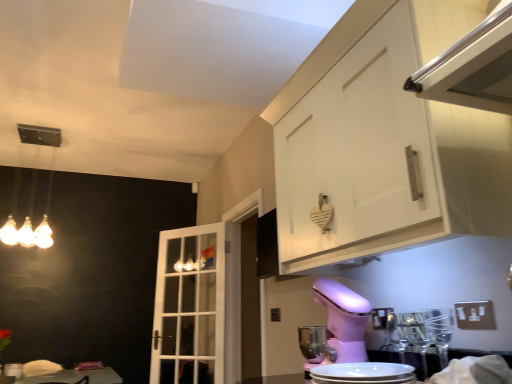
Question: Based on their sizes in the image, would you say pink plastic mixer at lower center is bigger or smaller than pink plastic stand mixer at lower center?

Choices:
 (A) small
 (B) big

Answer: (B)

Question: From a real-world perspective, is pink plastic mixer at lower center physically located above or below pink plastic stand mixer at lower center?

Choices:
 (A) above
 (B) below

Answer: (A)

Question: Considering the real-world distances, which object is closest to the white matte cabinet at upper right?

Choices:
 (A) white glass door at center
 (B) pink plastic mixer at lower center
 (C) pink plastic stand mixer at lower center
 (D) matte glass light fixture at upper left

Answer: (B)

Question: Based on their relative distances, which object is farther from the pink plastic mixer at lower center?

Choices:
 (A) white matte cabinet at upper right
 (B) white glass door at center
 (C) pink plastic stand mixer at lower center
 (D) matte glass light fixture at upper left

Answer: (D)